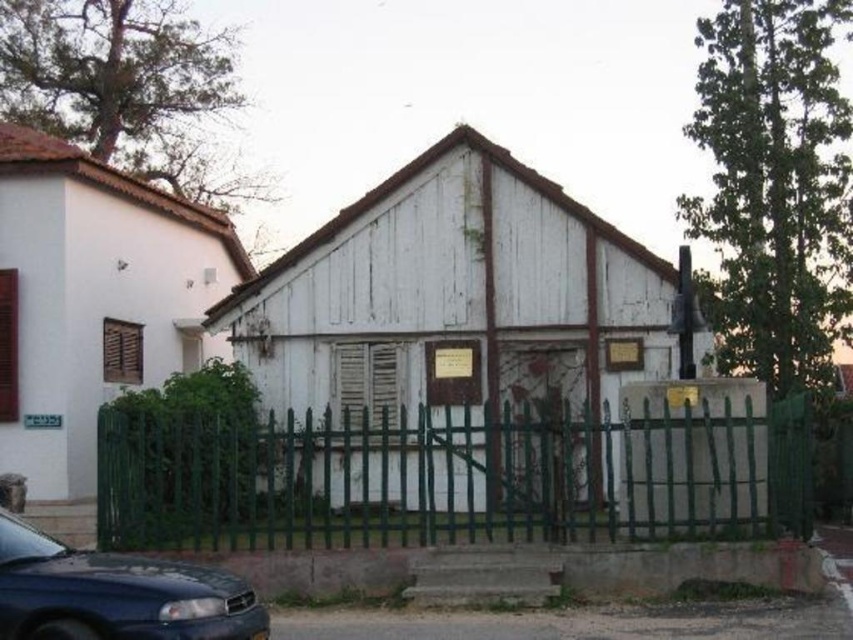
Between point (207, 429) and point (54, 545), which one is positioned in front?

Point (54, 545) is in front.

Describe the element at coordinates (450, 477) in the screenshot. The width and height of the screenshot is (853, 640). I see `green metal fence at center` at that location.

In order to click on green metal fence at center in this screenshot , I will do `click(450, 477)`.